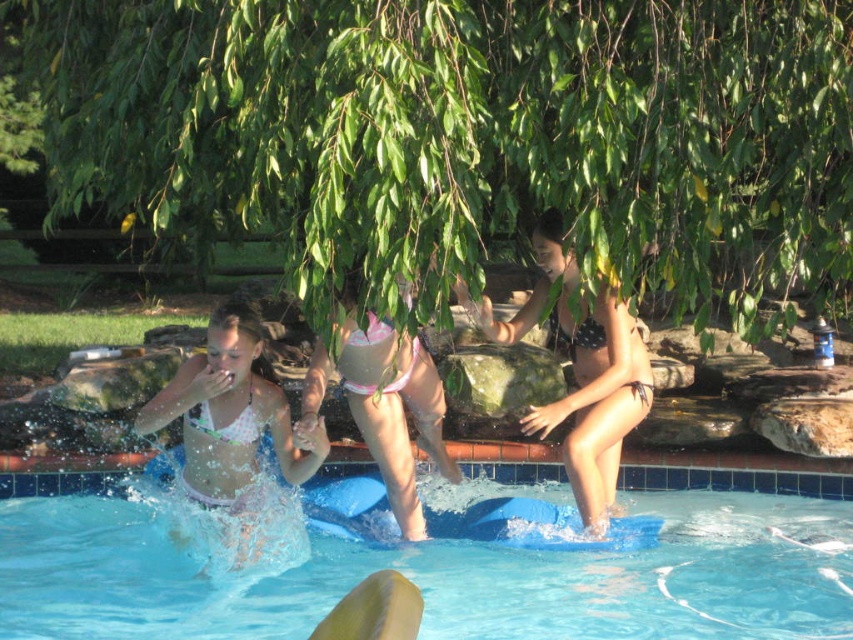
Is point (248, 440) less distant than point (354, 323)?

No, it is behind (354, 323).

Who is taller, white matte bikini at lower left or pink fabric bikini at center?

Standing taller between the two is pink fabric bikini at center.

Which is in front, point (233, 348) or point (376, 365)?

Positioned in front is point (233, 348).

This screenshot has width=853, height=640. What are the coordinates of `white matte bikini at lower left` in the screenshot? It's located at (236, 433).

Is blue rubber board at center positioned before polka dot bikini at center?

No, it is behind polka dot bikini at center.

Is point (6, 628) closer to viewer compared to point (544, 225)?

Yes, it is.

Which is in front, point (193, 596) or point (566, 310)?

Point (193, 596) is in front.

Locate an element on the screen. Image resolution: width=853 pixels, height=640 pixels. blue rubber board at center is located at coordinates (444, 570).

Can you confirm if green leafy tree at upper center is taller than blue rubber board at center?

Yes, green leafy tree at upper center is taller than blue rubber board at center.

Who is more distant from viewer, (599, 115) or (131, 570)?

The point (131, 570) is more distant.

Who is more forward, (257, 131) or (84, 525)?

Positioned in front is point (257, 131).

The height and width of the screenshot is (640, 853). I want to click on green leafy tree at upper center, so click(x=467, y=134).